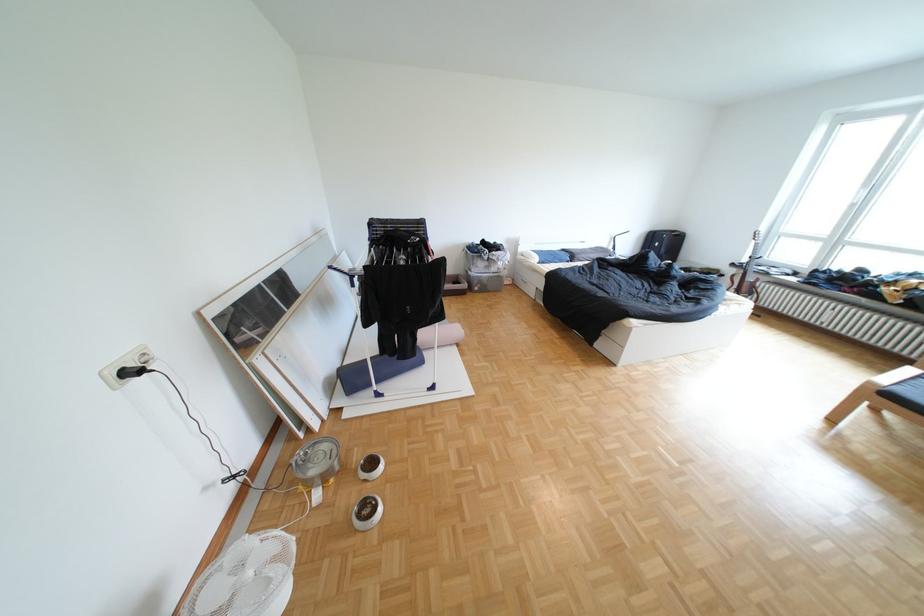
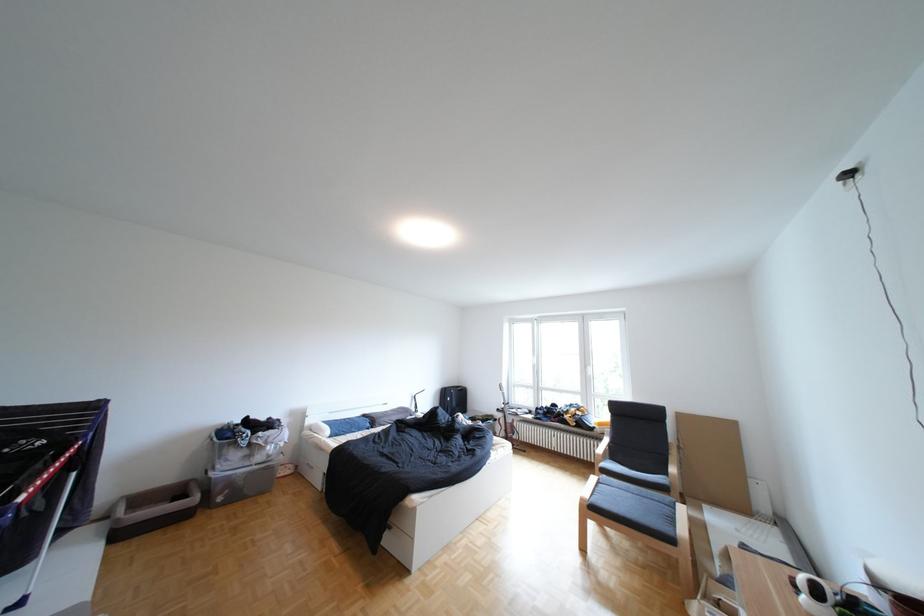
Where in the second image is the point corresponding to the point at 723,272 from the first image?

(502, 419)